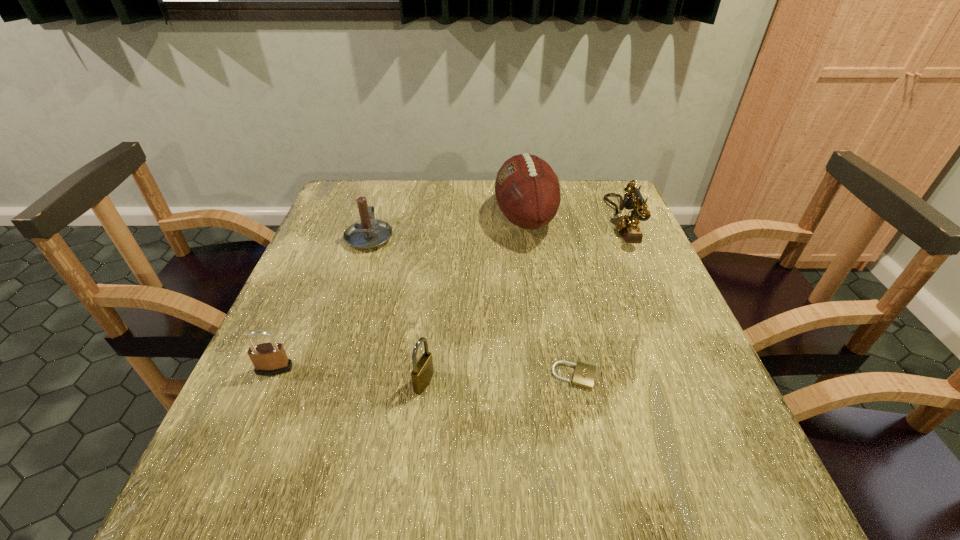
Locate an element on the screen. The height and width of the screenshot is (540, 960). vacant region located 0.380m on the front-facing side of the rightmost object is located at coordinates (476, 220).

Find the location of a particular element. The image size is (960, 540). free space located on the side of the candle with the handle loop is located at coordinates (385, 189).

Find the location of `vacant region located 0.150m on the side of the candle with the handle loop`. vacant region located 0.150m on the side of the candle with the handle loop is located at coordinates (383, 194).

The width and height of the screenshot is (960, 540). Find the location of `vacant space located on the right of the third object from left to right`. vacant space located on the right of the third object from left to right is located at coordinates (481, 382).

Identify the location of vacant point located 0.330m on the back of the leftmost object. This screenshot has height=540, width=960. (323, 258).

In order to click on free space located 0.160m on the front of the rightmost padlock in this screenshot , I will do `click(594, 477)`.

What are the coordinates of `football (American) situated at the far edge` in the screenshot? It's located at (527, 190).

Where is `telephone that is at the far edge`? telephone that is at the far edge is located at coordinates (628, 225).

I want to click on candle positioned at the far edge, so click(367, 233).

Locate an element on the screen. The width and height of the screenshot is (960, 540). candle at the left edge is located at coordinates (367, 233).